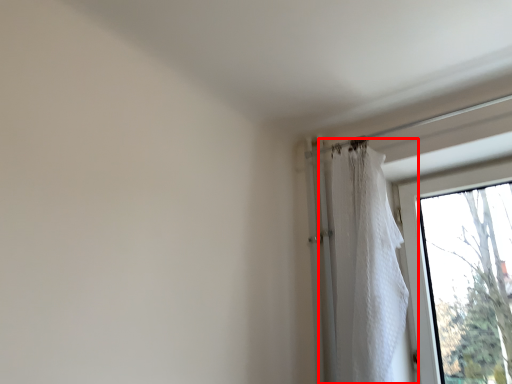
Question: From the image's perspective, where is curtain (annotated by the red box) located relative to window?

Choices:
 (A) above
 (B) below

Answer: (A)